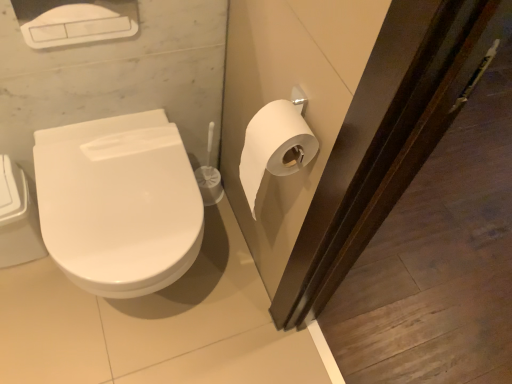
Question: From their relative heights in the image, would you say white glossy toilet at left is taller or shorter than white matte toilet paper at right?

Choices:
 (A) tall
 (B) short

Answer: (A)

Question: In terms of size, does white glossy toilet at left appear bigger or smaller than white matte toilet paper at right?

Choices:
 (A) small
 (B) big

Answer: (B)

Question: From the image's perspective, is white glossy toilet at left above or below white matte toilet paper at right?

Choices:
 (A) above
 (B) below

Answer: (B)

Question: Is white matte toilet paper at right bigger or smaller than white glossy toilet at left?

Choices:
 (A) small
 (B) big

Answer: (A)

Question: Looking at their shapes, would you say white matte toilet paper at right is wider or thinner than white glossy toilet at left?

Choices:
 (A) thin
 (B) wide

Answer: (A)

Question: From a real-world perspective, is white matte toilet paper at right above or below white glossy toilet at left?

Choices:
 (A) below
 (B) above

Answer: (B)

Question: From the image's perspective, is white matte toilet paper at right above or below white glossy toilet at left?

Choices:
 (A) below
 (B) above

Answer: (B)